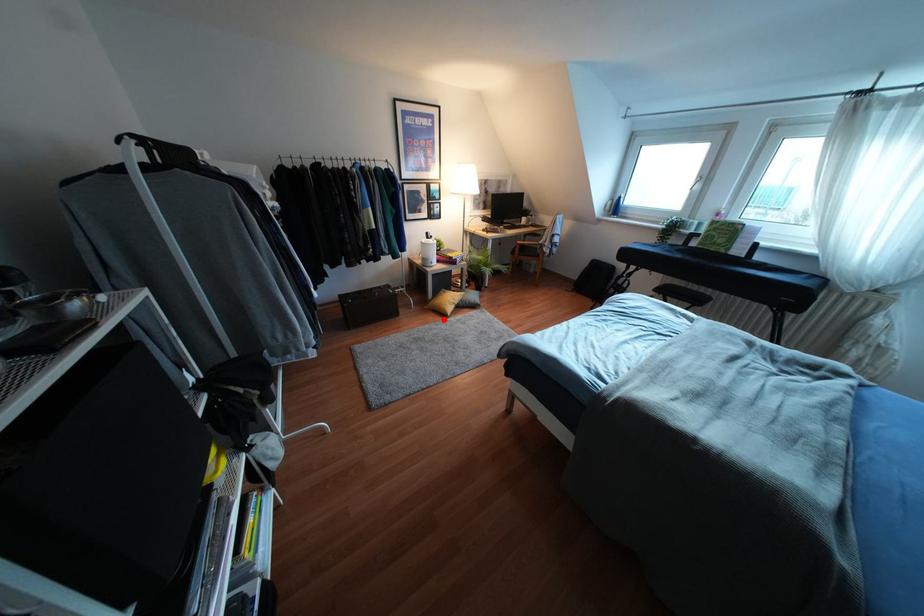
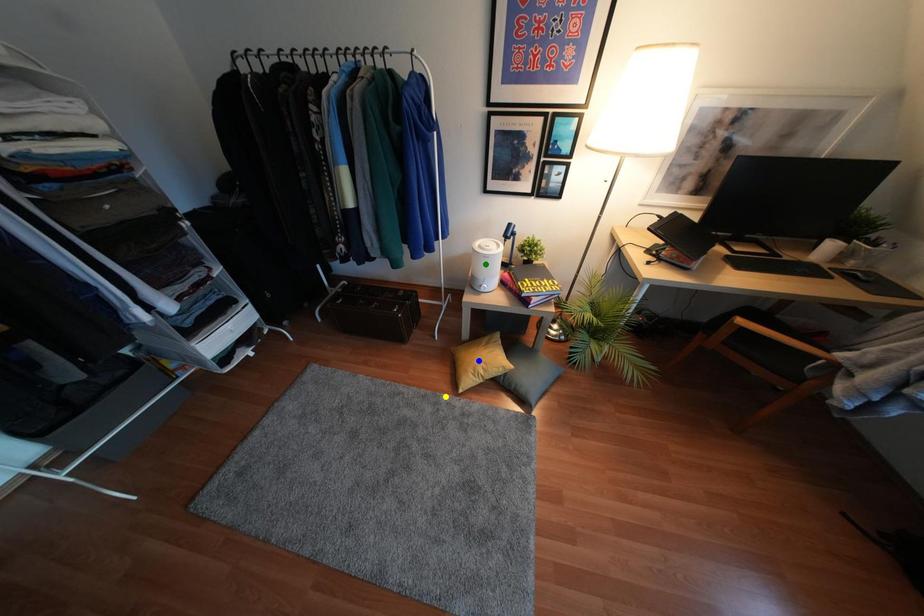
Question: I am providing you with two images of the same scene from different viewpoints. A red point is marked on the first image. You are given multiple points on the second image. Which spot in image 2 lines up with the point in image 1?

Choices:
 (A) yellow point
 (B) blue point
 (C) green point

Answer: (A)